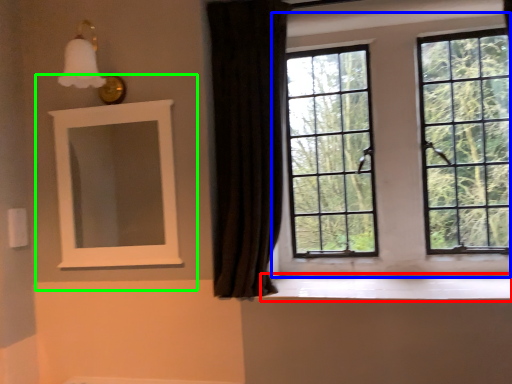
Question: Estimate the real-world distances between objects in this image. Which object is closer to window sill (highlighted by a red box), window (highlighted by a blue box) or medicine cabinet (highlighted by a green box)?

Choices:
 (A) window
 (B) medicine cabinet

Answer: (A)